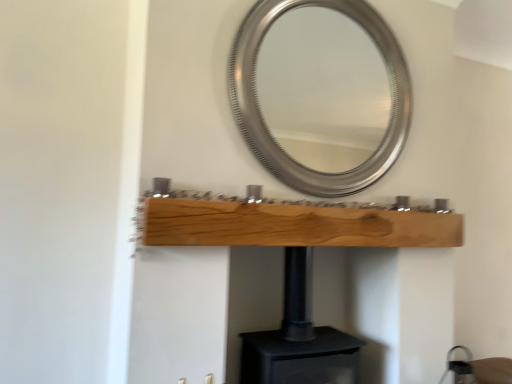
Find the location of a particular element. natural wood plank at center is located at coordinates (293, 225).

Locate an element on the screen. The image size is (512, 384). shelf on the left of silver metallic mirror at upper center is located at coordinates (293, 225).

Can you confirm if natural wood plank at center is thinner than silver metallic mirror at upper center?

No, natural wood plank at center is not thinner than silver metallic mirror at upper center.

Based on the photo, can you tell me how much natural wood plank at center and silver metallic mirror at upper center differ in facing direction?

There is a 0.00124-degree angle between the facing directions of natural wood plank at center and silver metallic mirror at upper center.

Is silver metallic mirror at upper center surrounded by black matte fireplace at center?

Definitely not — silver metallic mirror at upper center is not inside black matte fireplace at center.

Between black matte fireplace at center and silver metallic mirror at upper center, which one is positioned behind?

silver metallic mirror at upper center is further away from the camera.

Is silver metallic mirror at upper center at the back of black matte fireplace at center?

No, black matte fireplace at center is not facing away from silver metallic mirror at upper center.

From the image's perspective, which one is positioned higher, black matte fireplace at center or silver metallic mirror at upper center?

silver metallic mirror at upper center.

Who is bigger, silver metallic mirror at upper center or natural wood plank at center?

silver metallic mirror at upper center.

Which object is wider, silver metallic mirror at upper center or natural wood plank at center?

natural wood plank at center.

Does silver metallic mirror at upper center turn towards natural wood plank at center?

No.

From the picture: Would you say silver metallic mirror at upper center is to the left or to the right of natural wood plank at center in the picture?

From the image, it's evident that silver metallic mirror at upper center is to the right of natural wood plank at center.

Would you say silver metallic mirror at upper center contains black matte fireplace at center?

No, silver metallic mirror at upper center does not contain black matte fireplace at center.

Between point (370, 113) and point (300, 360), which one is positioned in front?

The point (300, 360) is more forward.

Is silver metallic mirror at upper center directly adjacent to black matte fireplace at center?

silver metallic mirror at upper center is not next to black matte fireplace at center, and they're not touching.

Can you confirm if silver metallic mirror at upper center is smaller than black matte fireplace at center?

Correct, silver metallic mirror at upper center occupies less space than black matte fireplace at center.

Is black matte fireplace at center directly adjacent to natural wood plank at center?

No, black matte fireplace at center is not touching natural wood plank at center.

What are the coordinates of `fireplace that appears below the natural wood plank at center (from the image's perspective)` in the screenshot? It's located at (298, 338).

Between black matte fireplace at center and natural wood plank at center, which one has smaller size?

Smaller between the two is natural wood plank at center.

From the image's perspective, which is above, black matte fireplace at center or natural wood plank at center?

From the image's view, natural wood plank at center is above.

Is natural wood plank at center facing away from black matte fireplace at center?

No, natural wood plank at center is not facing away from black matte fireplace at center.

Is natural wood plank at center far away from black matte fireplace at center?

That's not correct — natural wood plank at center is a little close to black matte fireplace at center.

From the image's perspective, is natural wood plank at center beneath black matte fireplace at center?

Actually, natural wood plank at center appears above black matte fireplace at center in the image.

At what (x,y) coordinates should I click in order to perform the action: click on fireplace that is behind the natural wood plank at center. Please return your answer as a coordinate pair (x, y). Looking at the image, I should click on (298, 338).

This screenshot has height=384, width=512. Identify the location of mirror behind the natural wood plank at center. (323, 89).

Locate an element on the screen. fireplace located below the silver metallic mirror at upper center (from the image's perspective) is located at coordinates (298, 338).

Considering their positions, is silver metallic mirror at upper center positioned further to natural wood plank at center than black matte fireplace at center?

silver metallic mirror at upper center is further to natural wood plank at center.

Which object lies further to the anchor point black matte fireplace at center, silver metallic mirror at upper center or natural wood plank at center?

The object further to black matte fireplace at center is silver metallic mirror at upper center.

Considering their positions, is natural wood plank at center positioned further to black matte fireplace at center than silver metallic mirror at upper center?

Based on the image, silver metallic mirror at upper center appears to be further to black matte fireplace at center.

Based on their spatial positions, is natural wood plank at center or black matte fireplace at center further from silver metallic mirror at upper center?

The object further to silver metallic mirror at upper center is natural wood plank at center.

Consider the image. When comparing their distances from natural wood plank at center, does black matte fireplace at center or silver metallic mirror at upper center seem closer?

black matte fireplace at center lies closer to natural wood plank at center than the other object.

Looking at the image, which one is located further to silver metallic mirror at upper center, black matte fireplace at center or natural wood plank at center?

Among the two, natural wood plank at center is located further to silver metallic mirror at upper center.

Find the location of `shelf between silver metallic mirror at upper center and black matte fireplace at center from top to bottom`. shelf between silver metallic mirror at upper center and black matte fireplace at center from top to bottom is located at coordinates (293, 225).